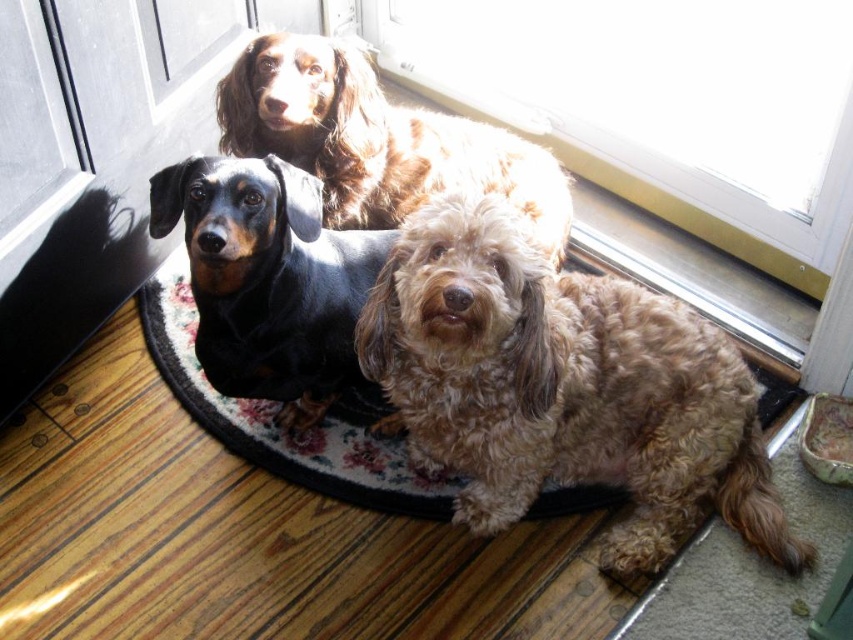
You are standing in front of the glass door and want to find the point that is closer to you. Which point is closer to you between point [618,564] and point [276,164]?

Point [276,164] is closer to you because it is in front of point [618,564].

You are standing in front of the glass door and see two points marked on the mat. Which point is closer to you, point (546, 272) or point (491, 180)?

Point (546, 272) is in front of point (491, 180), so it is closer to you.

You are a dog owner who wants to ensure your black shiny dachshund at center stays warm while sitting on the fluffy carpet at center. Based on the scene description, is the carpet likely to provide adequate warmth for the dog?

The black shiny dachshund at center is positioned over the fluffy carpet at center. Fluffy carpets generally provide more insulation and warmth compared to hard surfaces like wood or tile, so the fluffy carpet at center should help keep the dog warm.